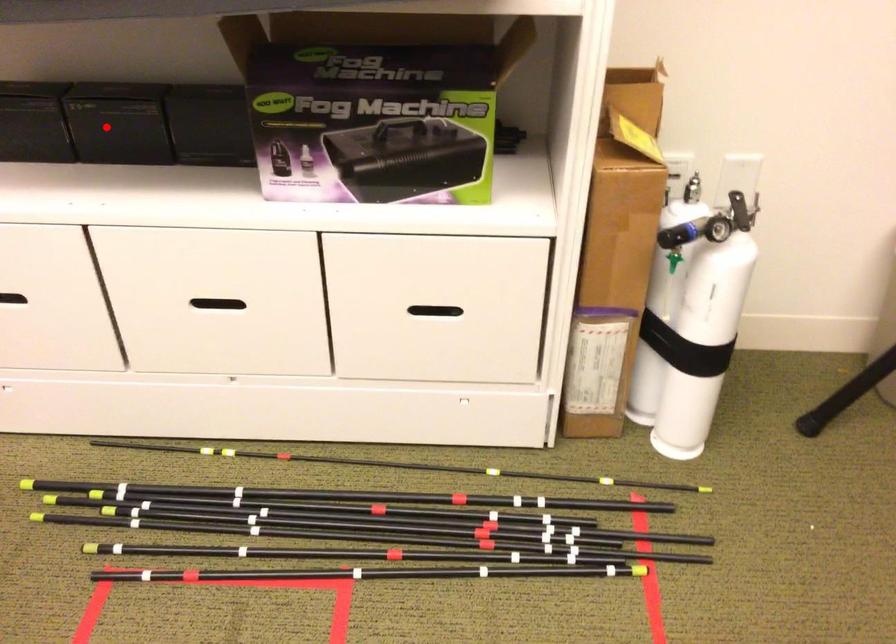
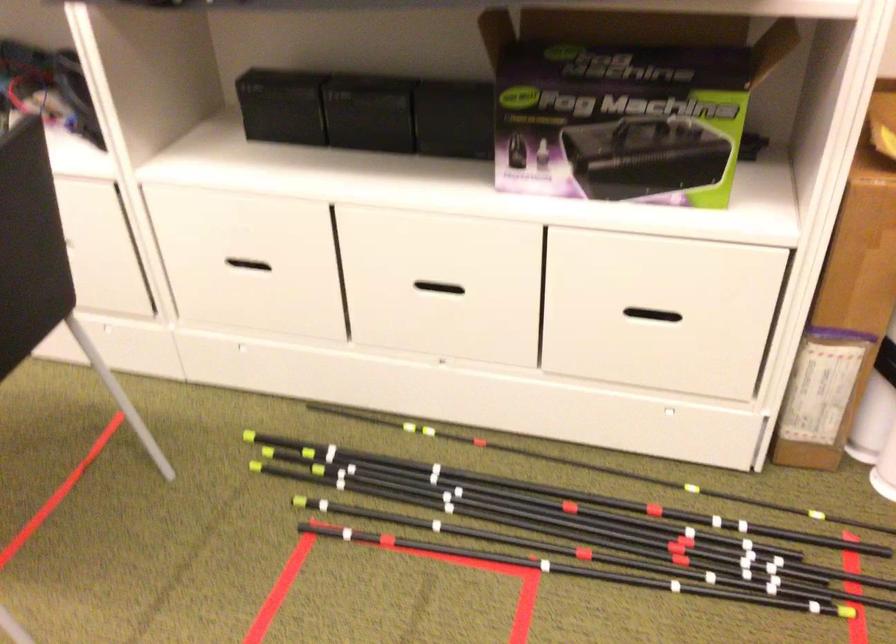
Locate, in the second image, the point that corresponds to the highlighted location in the first image.

(363, 111)